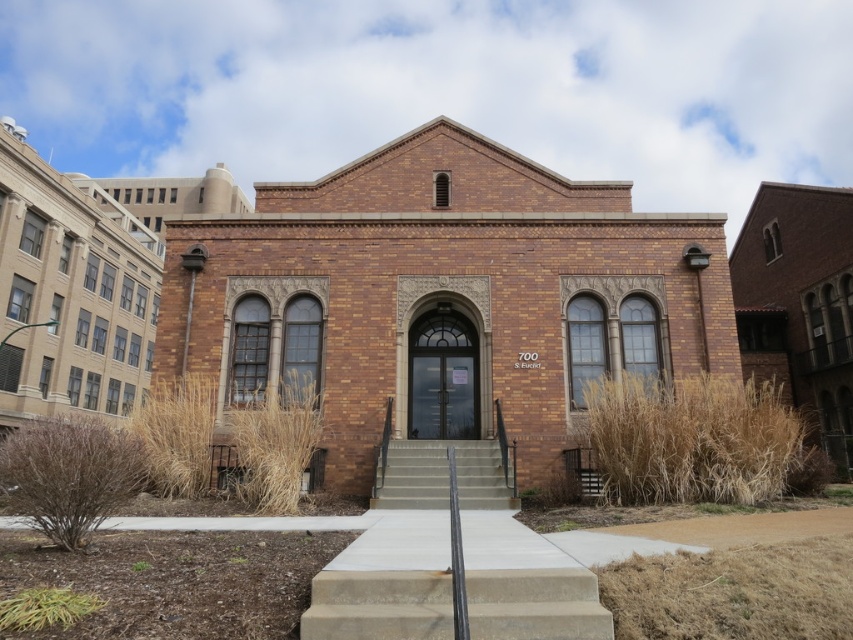
Question: Is concrete/steps at center above concrete stairs at center?

Choices:
 (A) no
 (B) yes

Answer: (B)

Question: Is concrete/steps at center above concrete stairs at center?

Choices:
 (A) yes
 (B) no

Answer: (A)

Question: Which point is farther to the camera?

Choices:
 (A) [x=44, y=262]
 (B) [x=334, y=636]

Answer: (A)

Question: Which of the following is the closest to the observer?

Choices:
 (A) brown brick church at center
 (B) brown brick chapel at center
 (C) concrete stairs at center
 (D) concrete/steps at center

Answer: (D)

Question: Which object is closer to the camera taking this photo?

Choices:
 (A) concrete/steps at center
 (B) brown brick church at center

Answer: (A)

Question: Does concrete/steps at center have a lesser width compared to concrete stairs at center?

Choices:
 (A) yes
 (B) no

Answer: (A)